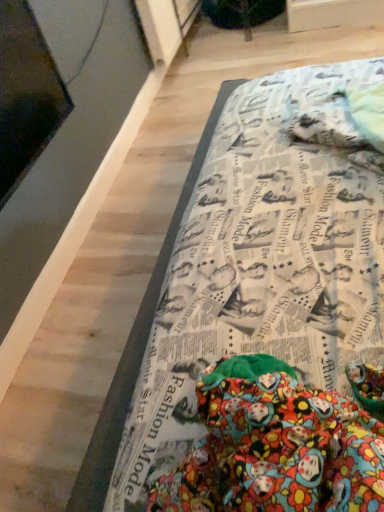
What is the approximate height of printed fabric blanket at center?

printed fabric blanket at center is 2.43 inches in height.

Find the location of a particular element. The height and width of the screenshot is (512, 384). printed fabric blanket at center is located at coordinates (268, 315).

The height and width of the screenshot is (512, 384). What do you see at coordinates (268, 315) in the screenshot?
I see `printed fabric blanket at center` at bounding box center [268, 315].

What are the coordinates of `printed fabric blanket at center` in the screenshot? It's located at (268, 315).